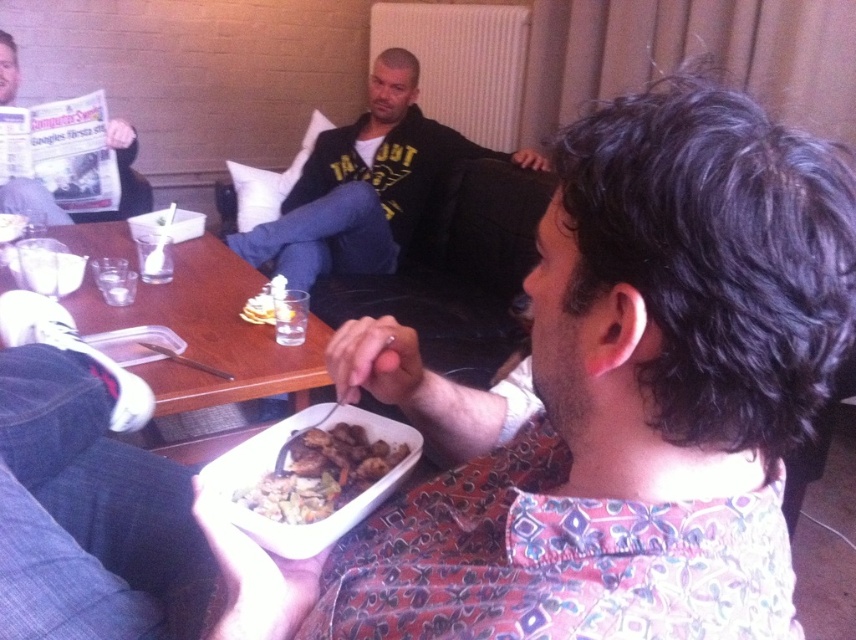
Question: Which of the following is the closest to the observer?

Choices:
 (A) (337, 435)
 (B) (111, 131)

Answer: (A)

Question: Can you confirm if dark blue jeans at center is positioned below brown matte meat at center?

Choices:
 (A) yes
 (B) no

Answer: (B)

Question: Is dark blue jeans at center to the right of brown matte meat at center from the viewer's perspective?

Choices:
 (A) yes
 (B) no

Answer: (B)

Question: Which of the following is the farthest from the observer?

Choices:
 (A) (283, 202)
 (B) (331, 488)
 (C) (306, 396)
 (D) (62, 212)

Answer: (A)

Question: Which point is closer to the camera taking this photo?

Choices:
 (A) (34, 182)
 (B) (311, 432)
 (C) (230, 257)

Answer: (B)

Question: Does brown matte meat at center appear on the left side of matte black newspaper at upper left?

Choices:
 (A) yes
 (B) no

Answer: (B)